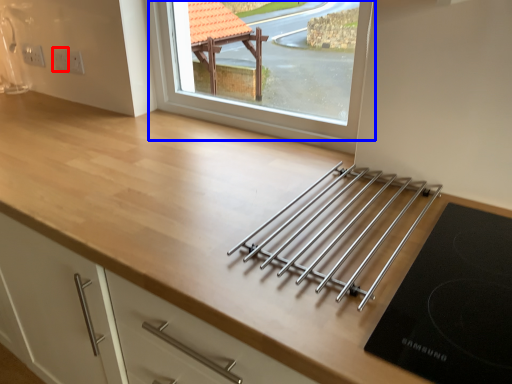
Question: Which object is closer to the camera taking this photo, electric outlet (highlighted by a red box) or window (highlighted by a blue box)?

Choices:
 (A) electric outlet
 (B) window

Answer: (B)